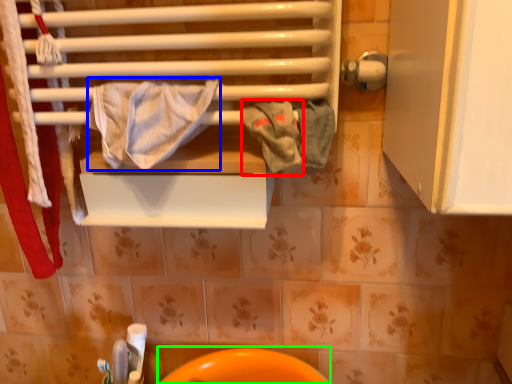
Question: Considering the real-world distances, which object is farthest from bath towel (highlighted by a red box)? bath towel (highlighted by a blue box) or sink (highlighted by a green box)?

Choices:
 (A) bath towel
 (B) sink

Answer: (B)